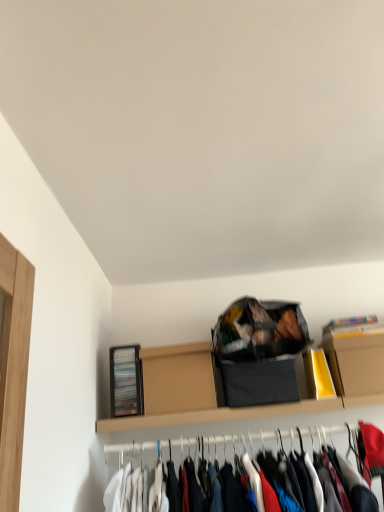
Question: Relative to cardboard box at upper right, arranged as the first cardboard box when viewed from the right, is matte black bag at upper center in front or behind?

Choices:
 (A) behind
 (B) front

Answer: (B)

Question: From the image's perspective, is matte black bag at upper center positioned above or below cardboard box at upper right, arranged as the first cardboard box when viewed from the right?

Choices:
 (A) above
 (B) below

Answer: (A)

Question: Based on their relative distances, which object is farther from the cardboard box at upper right, arranged as the second cardboard box when viewed from the left?

Choices:
 (A) matte black bag at upper center
 (B) brown cardboard box at upper center, which ranks as the 1th cardboard box in left-to-right order

Answer: (B)

Question: Estimate the real-world distances between objects in this image. Which object is closer to the cardboard box at upper right, arranged as the first cardboard box when viewed from the right?

Choices:
 (A) matte black bag at upper center
 (B) brown cardboard box at upper center, which ranks as the 1th cardboard box in left-to-right order

Answer: (A)